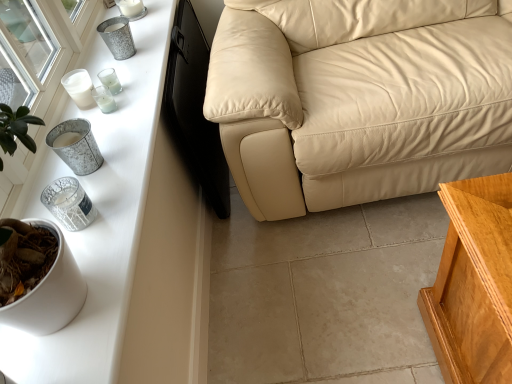
I want to click on free space to the right of metallic candle holder at upper left, the 4th candle holder when ordered from bottom to top, so click(137, 95).